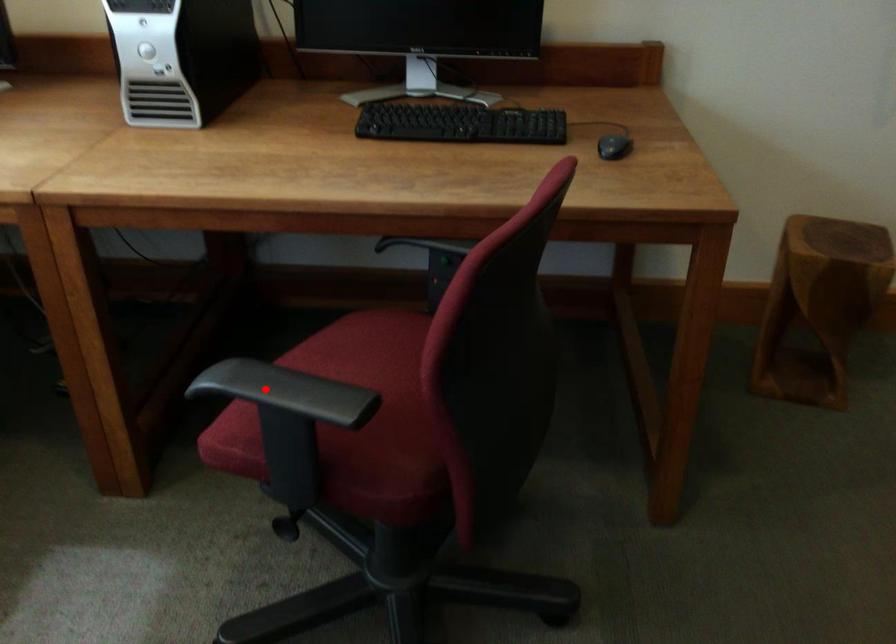
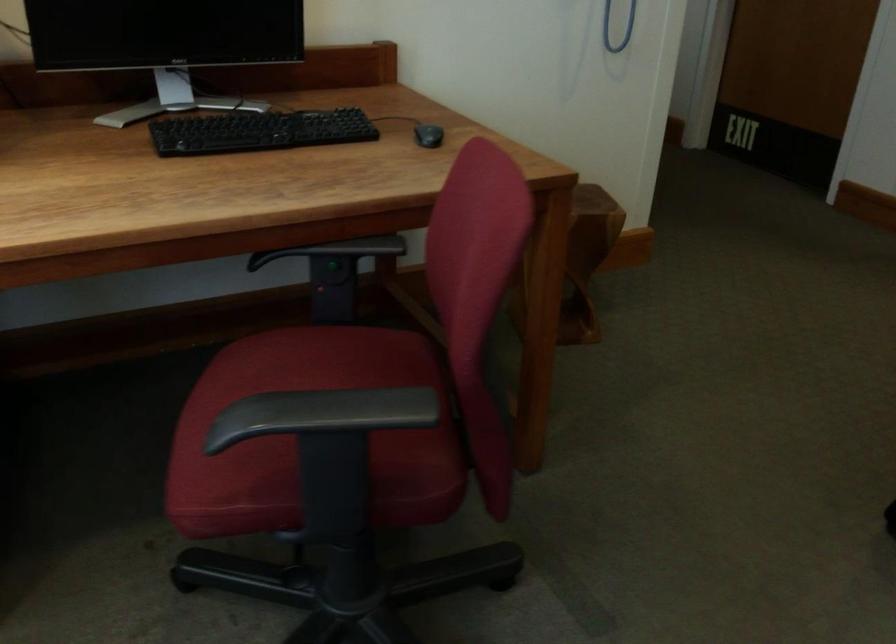
Question: I am providing you with two images of the same scene from different viewpoints. A red point is shown in image1. For the corresponding object point in image2, is it positioned nearer or farther from the camera?

Choices:
 (A) Nearer
 (B) Farther

Answer: (A)